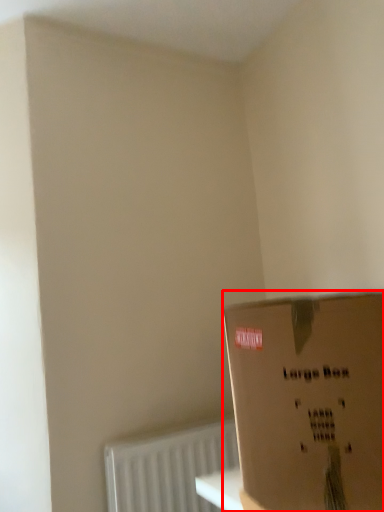
Question: From the image's perspective, where is box (annotated by the red box) located in relation to radiator in the image?

Choices:
 (A) above
 (B) below

Answer: (A)